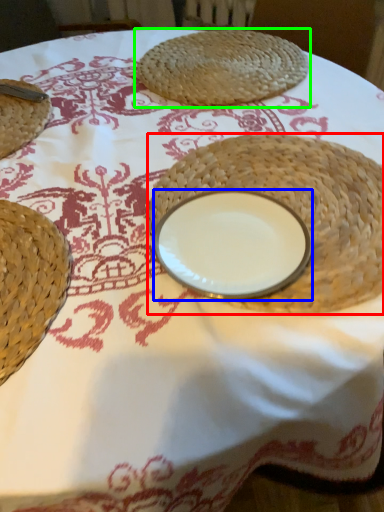
Question: Estimate the real-world distances between objects in this image. Which object is closer to straw hat (highlighted by a red box), tableware (highlighted by a blue box) or food (highlighted by a green box)?

Choices:
 (A) tableware
 (B) food

Answer: (A)